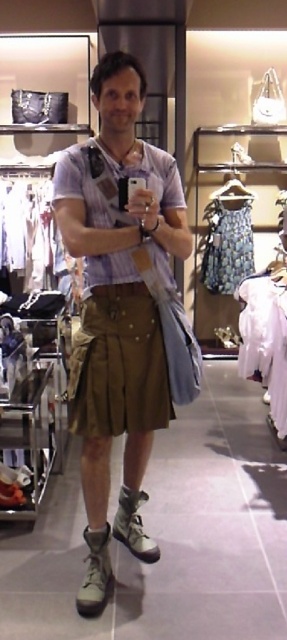
Is brown pleated kilt at center closer to the viewer compared to printed fabric dress at center?

Yes, brown pleated kilt at center is closer to the viewer.

Who is more forward, (156, 376) or (243, 212)?

Point (156, 376)

What do you see at coordinates (119, 364) in the screenshot? I see `brown pleated kilt at center` at bounding box center [119, 364].

The width and height of the screenshot is (287, 640). I want to click on brown pleated kilt at center, so click(x=119, y=364).

Between point (132, 410) and point (84, 424), which one is positioned behind?

The point (132, 410) is more distant.

Can you confirm if brown cotton kilt at center is positioned below brown pleated kilt at center?

Incorrect, brown cotton kilt at center is not positioned below brown pleated kilt at center.

Which is in front, point (84, 324) or point (94, 316)?

Point (94, 316) is more forward.

Identify the location of brown cotton kilt at center. (123, 308).

Can you confirm if brown cotton kilt at center is thinner than printed fabric dress at center?

No, brown cotton kilt at center is not thinner than printed fabric dress at center.

What do you see at coordinates (123, 308) in the screenshot?
I see `brown cotton kilt at center` at bounding box center [123, 308].

The width and height of the screenshot is (287, 640). What are the coordinates of `brown cotton kilt at center` in the screenshot? It's located at (123, 308).